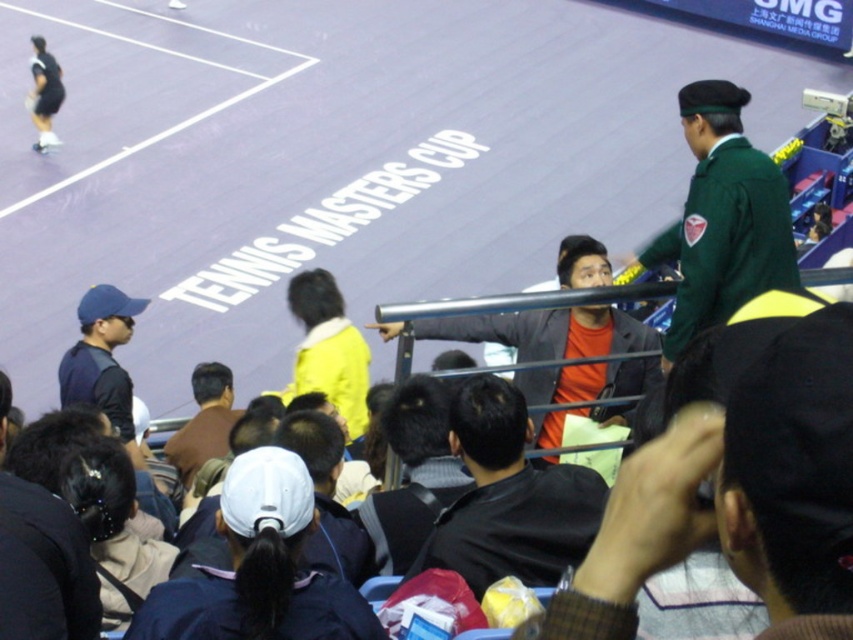
Question: Can you confirm if white fabric cap at center is wider than brown leather jacket at center?

Choices:
 (A) no
 (B) yes

Answer: (B)

Question: Does white fabric cap at center have a lesser width compared to black leather jacket at center?

Choices:
 (A) no
 (B) yes

Answer: (A)

Question: Which of the following is the farthest from the observer?

Choices:
 (A) (163, 244)
 (B) (242, 516)
 (C) (122, 340)

Answer: (A)

Question: Estimate the real-world distances between objects in this image. Which object is farther from the dark blue cap at left?

Choices:
 (A) orange matte shirt at center
 (B) purple synthetic surface at center

Answer: (A)

Question: Is green uniform at upper right in front of orange matte jacket at center?

Choices:
 (A) yes
 (B) no

Answer: (A)

Question: Based on their relative distances, which object is nearer to the green uniform at upper right?

Choices:
 (A) black leather jacket at center
 (B) orange matte shirt at center
 (C) dark blue jacket at lower left

Answer: (A)